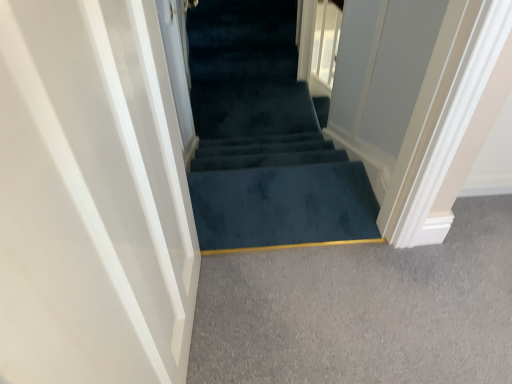
Image resolution: width=512 pixels, height=384 pixels. What do you see at coordinates (92, 198) in the screenshot? I see `white glossy door at left` at bounding box center [92, 198].

Locate an element on the screen. Image resolution: width=512 pixels, height=384 pixels. white glossy door at left is located at coordinates (92, 198).

This screenshot has height=384, width=512. Find the location of `teal carpeted stairs at center`. teal carpeted stairs at center is located at coordinates (265, 138).

Describe the element at coordinates (265, 138) in the screenshot. This screenshot has width=512, height=384. I see `teal carpeted stairs at center` at that location.

At what (x,y) coordinates should I click in order to perform the action: click on white glossy door at left. Please return your answer as a coordinate pair (x, y). The width and height of the screenshot is (512, 384). Looking at the image, I should click on (92, 198).

Is teal carpeted stairs at center at the left side of white glossy door at left?

No, teal carpeted stairs at center is not to the left of white glossy door at left.

Considering the positions of objects teal carpeted stairs at center and white glossy door at left in the image provided, who is behind, teal carpeted stairs at center or white glossy door at left?

teal carpeted stairs at center is behind.

Considering the points (265, 154) and (61, 232), which point is behind, point (265, 154) or point (61, 232)?

The point (265, 154) is behind.

In the scene shown: From the image's perspective, which object appears higher, teal carpeted stairs at center or white glossy door at left?

teal carpeted stairs at center, from the image's perspective.

From a real-world perspective, does teal carpeted stairs at center stand above white glossy door at left?

No.

Is teal carpeted stairs at center wider than white glossy door at left?

In fact, teal carpeted stairs at center might be narrower than white glossy door at left.

Considering the sizes of objects teal carpeted stairs at center and white glossy door at left in the image provided, who is shorter, teal carpeted stairs at center or white glossy door at left?

teal carpeted stairs at center is shorter.

Considering the relative sizes of teal carpeted stairs at center and white glossy door at left in the image provided, is teal carpeted stairs at center bigger than white glossy door at left?

No.

Is white glossy door at left surrounded by teal carpeted stairs at center?

No, white glossy door at left is located outside of teal carpeted stairs at center.

Is there a large distance between teal carpeted stairs at center and white glossy door at left?

Yes, teal carpeted stairs at center and white glossy door at left are located far from each other.

Is teal carpeted stairs at center turned away from white glossy door at left?

That's not correct — teal carpeted stairs at center is not looking away from white glossy door at left.

Image resolution: width=512 pixels, height=384 pixels. In order to click on door in front of the teal carpeted stairs at center in this screenshot , I will do `click(92, 198)`.

Considering the relative positions of white glossy door at left and teal carpeted stairs at center in the image provided, is white glossy door at left to the right of teal carpeted stairs at center from the viewer's perspective?

No, white glossy door at left is not to the right of teal carpeted stairs at center.

Considering their positions, is white glossy door at left located in front of or behind teal carpeted stairs at center?

Visually, white glossy door at left is located in front of teal carpeted stairs at center.

Between point (1, 353) and point (243, 25), which one is positioned in front?

Positioned in front is point (1, 353).

From the image's perspective, is white glossy door at left located above or below teal carpeted stairs at center?

From the image's perspective, white glossy door at left appears below teal carpeted stairs at center.

From a real-world perspective, which object stands above the other?

white glossy door at left.

Is white glossy door at left wider than teal carpeted stairs at center?

Yes.

In the scene shown: Considering the sizes of objects white glossy door at left and teal carpeted stairs at center in the image provided, who is taller, white glossy door at left or teal carpeted stairs at center?

Standing taller between the two is white glossy door at left.

Which of these two, white glossy door at left or teal carpeted stairs at center, is smaller?

With smaller size is teal carpeted stairs at center.

Based on the photo, is white glossy door at left spatially inside teal carpeted stairs at center, or outside of it?

white glossy door at left is outside teal carpeted stairs at center.

Are white glossy door at left and teal carpeted stairs at center beside each other?

No, white glossy door at left is not making contact with teal carpeted stairs at center.

Does white glossy door at left turn towards teal carpeted stairs at center?

Yes, white glossy door at left is oriented towards teal carpeted stairs at center.

You are a GUI agent. You are given a task and a screenshot of the screen. Output one action in this format:
    pyautogui.click(x=<x>, y=<y>)
    Task: Click on the stairs behind the white glossy door at left
    The height and width of the screenshot is (384, 512).
    Given the screenshot: What is the action you would take?
    pyautogui.click(x=265, y=138)

Locate an element on the screen. stairs located behind the white glossy door at left is located at coordinates (265, 138).

At what (x,y) coordinates should I click in order to perform the action: click on door below the teal carpeted stairs at center (from the image's perspective). Please return your answer as a coordinate pair (x, y). The image size is (512, 384). Looking at the image, I should click on (92, 198).